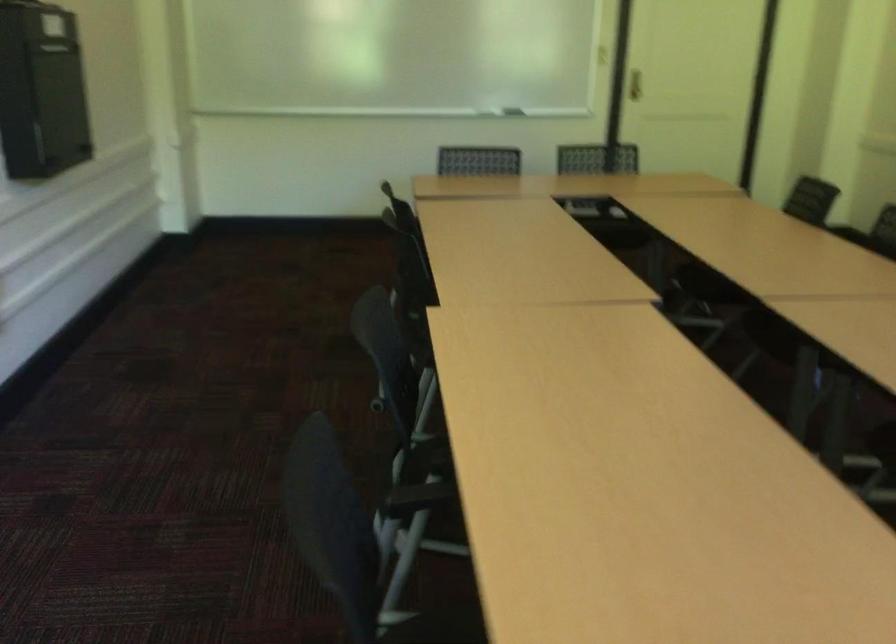
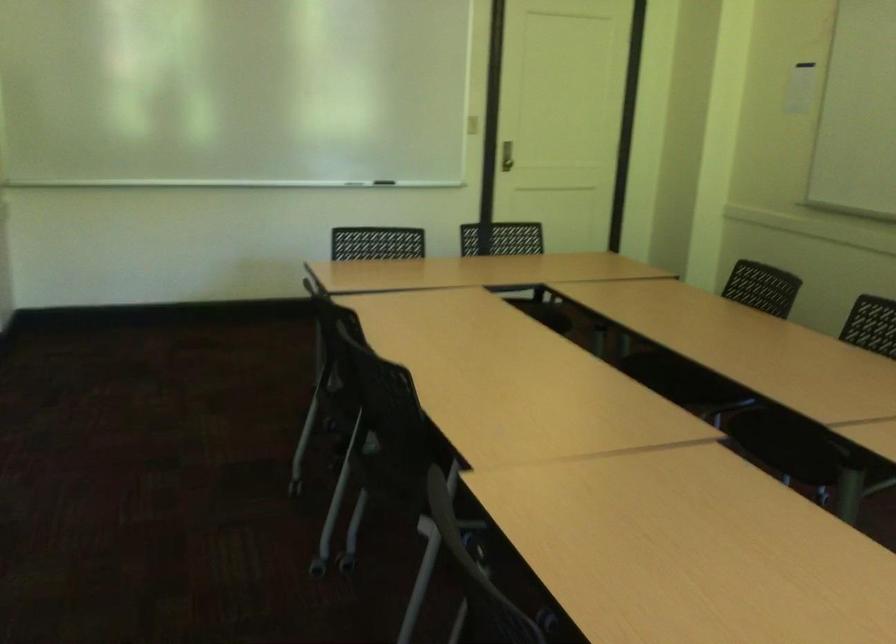
In a continuous first-person perspective shot, in which direction is the camera moving?

The cameraman walked toward left, forward.